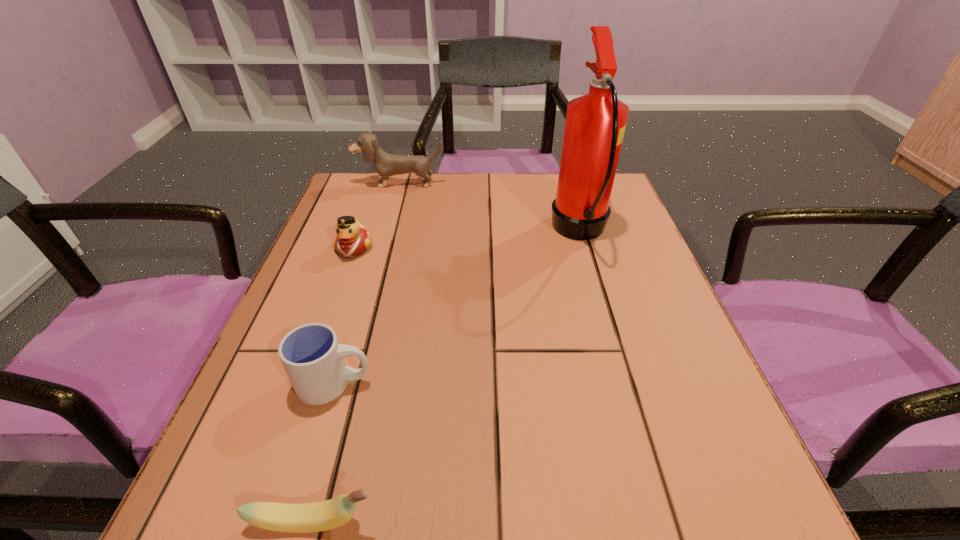
Identify the location of unoccupied area between the cup and the rightmost object. (457, 308).

This screenshot has height=540, width=960. I want to click on the third closest object relative to the cup, so click(x=595, y=123).

Select which object is the fourth closest to the cup. Please provide its 2D coordinates. Your answer should be formatted as a tuple, i.e. [(x, y)], where the tuple contains the x and y coordinates of a point satisfying the conditions above.

[(385, 164)]